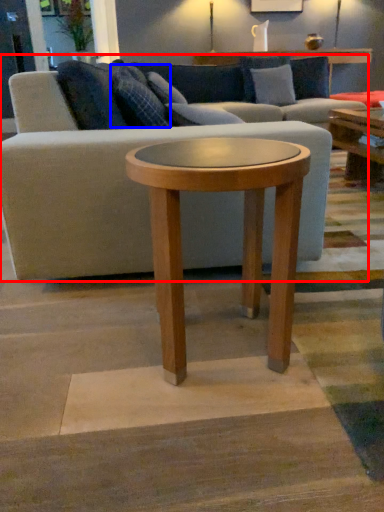
Question: Which point is further to the camera, studio couch (highlighted by a red box) or pillow (highlighted by a blue box)?

Choices:
 (A) studio couch
 (B) pillow

Answer: (B)